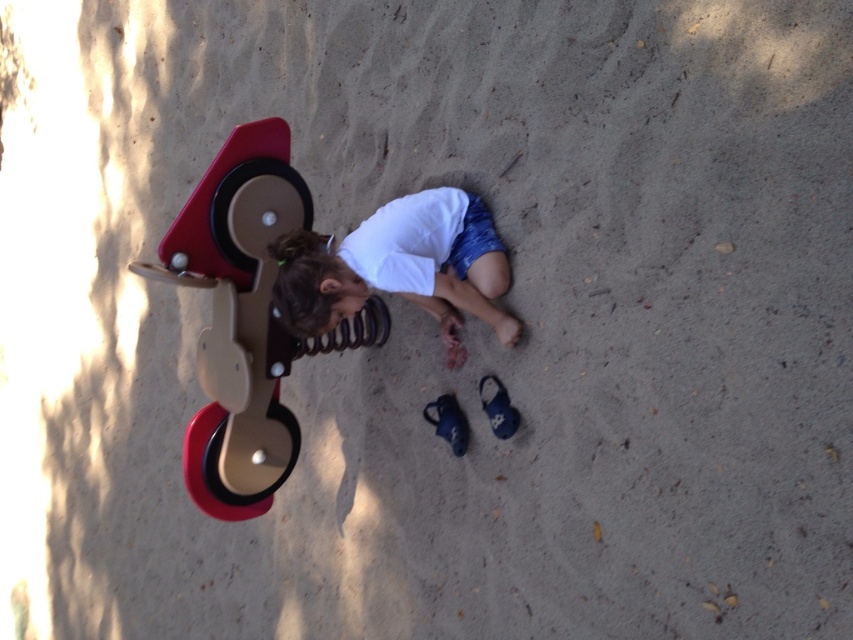
Describe the element at coordinates (399, 268) in the screenshot. I see `white cotton shirt at center` at that location.

Is white cotton shirt at center below blue suede shoe at lower center?

Incorrect, white cotton shirt at center is not positioned below blue suede shoe at lower center.

At what (x,y) coordinates should I click in order to perform the action: click on white cotton shirt at center. Please return your answer as a coordinate pair (x, y). The image size is (853, 640). Looking at the image, I should click on (399, 268).

Is beige plastic swing at left closer to the viewer compared to blue fabric shoe at lower center?

Yes, beige plastic swing at left is closer to the viewer.

What do you see at coordinates (236, 317) in the screenshot?
I see `beige plastic swing at left` at bounding box center [236, 317].

Between point (231, 365) and point (444, 419), which one is positioned in front?

Point (231, 365) is more forward.

This screenshot has height=640, width=853. I want to click on beige plastic swing at left, so [236, 317].

Does blue fabric shoe at lower center have a lesser height compared to blue suede shoe at lower center?

Incorrect, blue fabric shoe at lower center's height does not fall short of blue suede shoe at lower center's.

Who is shorter, blue fabric shoe at lower center or blue suede shoe at lower center?

Standing shorter between the two is blue suede shoe at lower center.

Which is behind, point (434, 432) or point (492, 432)?

The point (434, 432) is more distant.

This screenshot has height=640, width=853. What are the coordinates of `blue fabric shoe at lower center` in the screenshot? It's located at (448, 422).